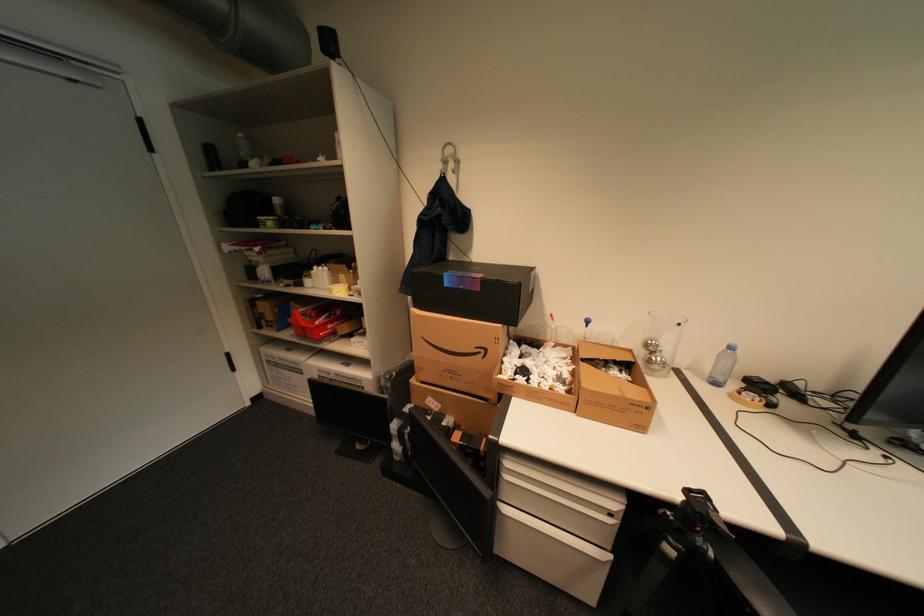
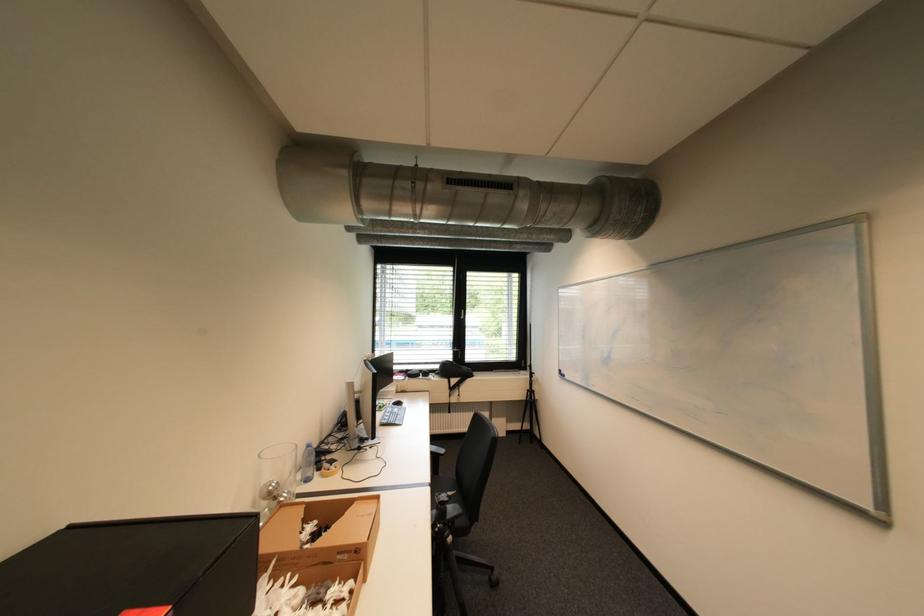
Question: I am providing you with two images of the same scene from different viewpoints. Which of the following objects are not visible in image2?

Choices:
 (A) black tripod
 (B) black window handle
 (C) cardboard box
 (D) none of these

Answer: (D)